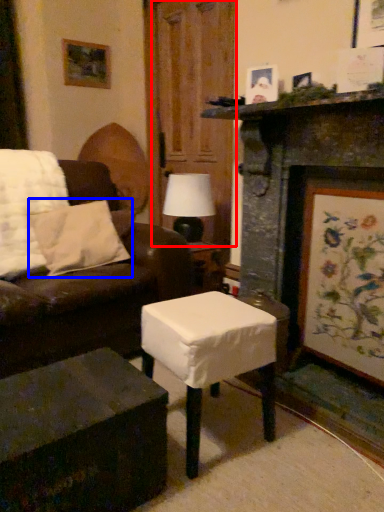
Question: Which point is further to the camera, glass door (highlighted by a red box) or pillow (highlighted by a blue box)?

Choices:
 (A) glass door
 (B) pillow

Answer: (A)